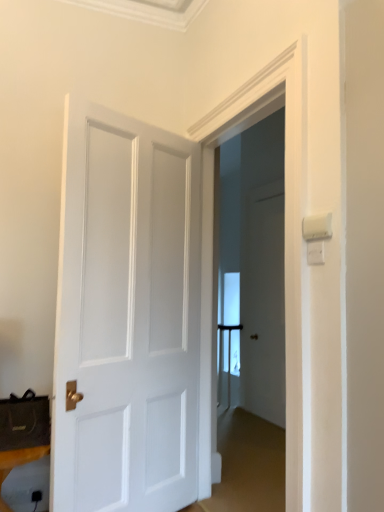
Question: Should I look upward or downward to see black plastic speaker at lower left?

Choices:
 (A) down
 (B) up

Answer: (A)

Question: Is black plastic speaker at lower left facing away from white matte door at center?

Choices:
 (A) yes
 (B) no

Answer: (B)

Question: Does black plastic speaker at lower left have a larger size compared to white matte door at center?

Choices:
 (A) yes
 (B) no

Answer: (B)

Question: Does black plastic speaker at lower left contain white matte door at center?

Choices:
 (A) no
 (B) yes

Answer: (A)

Question: From a real-world perspective, is black plastic speaker at lower left located beneath white matte door at center?

Choices:
 (A) yes
 (B) no

Answer: (A)

Question: Is black plastic speaker at lower left not within white matte door at center?

Choices:
 (A) no
 (B) yes

Answer: (B)

Question: From the image's perspective, does black plastic speaker at lower left appear lower than white matte door at center?

Choices:
 (A) no
 (B) yes

Answer: (B)

Question: Is white matte door at center completely or partially outside of black plastic speaker at lower left?

Choices:
 (A) yes
 (B) no

Answer: (A)

Question: Is white matte door at center at the left side of black plastic speaker at lower left?

Choices:
 (A) no
 (B) yes

Answer: (A)

Question: Is white matte door at center wider than black plastic speaker at lower left?

Choices:
 (A) no
 (B) yes

Answer: (A)

Question: Would you say white matte door at center contains black plastic speaker at lower left?

Choices:
 (A) yes
 (B) no

Answer: (B)

Question: Is white matte door at center looking in the opposite direction of black plastic speaker at lower left?

Choices:
 (A) yes
 (B) no

Answer: (A)

Question: Is white matte door at center positioned in front of black plastic speaker at lower left?

Choices:
 (A) no
 (B) yes

Answer: (A)

Question: From their relative heights in the image, would you say black plastic speaker at lower left is taller or shorter than white matte door at center?

Choices:
 (A) short
 (B) tall

Answer: (A)